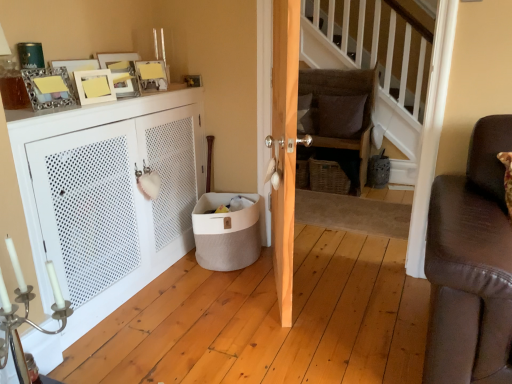
This screenshot has height=384, width=512. Identify the location of free space above velvet gray pillow at center, the 2th pillow when ordered from right to left (from a real-world perspective). (306, 84).